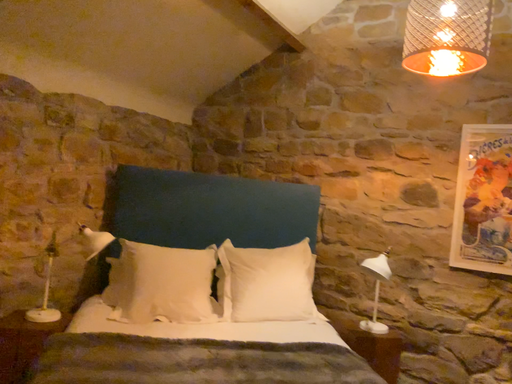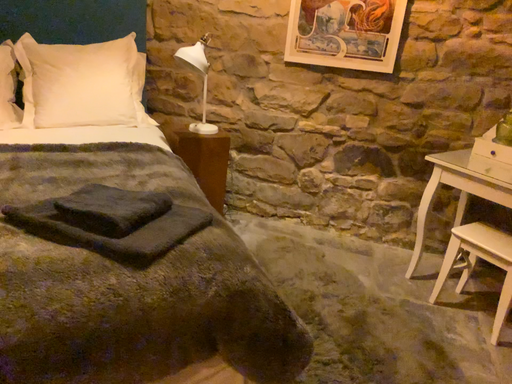
Question: Which way did the camera rotate in the video?

Choices:
 (A) rotated downward
 (B) rotated upward

Answer: (A)